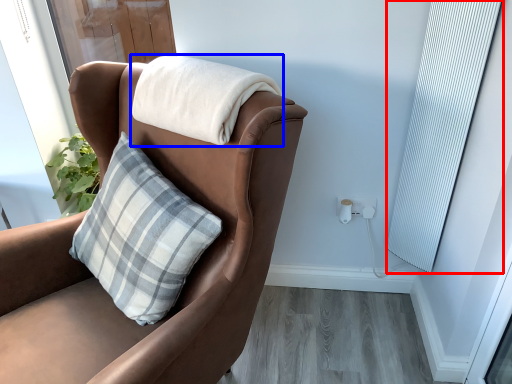
Question: Which of the following is the farthest to the observer, curtain (highlighted by a red box) or blanket (highlighted by a blue box)?

Choices:
 (A) curtain
 (B) blanket

Answer: (A)